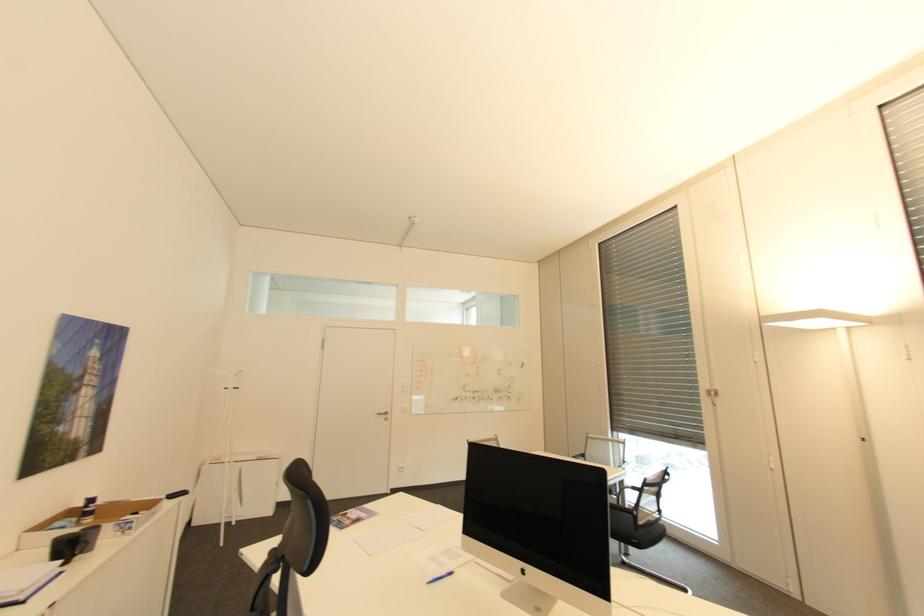
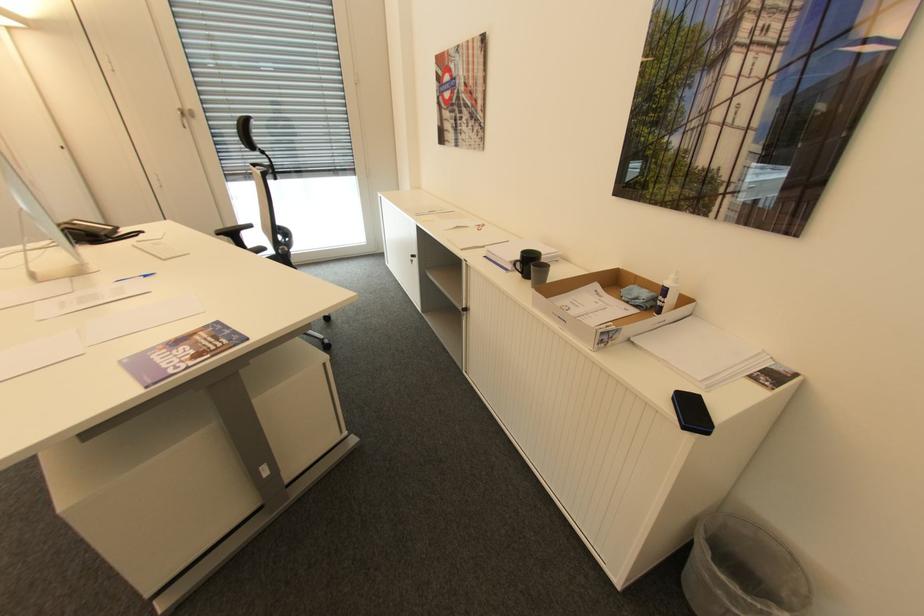
Locate, in the second image, the point that corresponds to pixel 99 499 in the first image.

(670, 291)